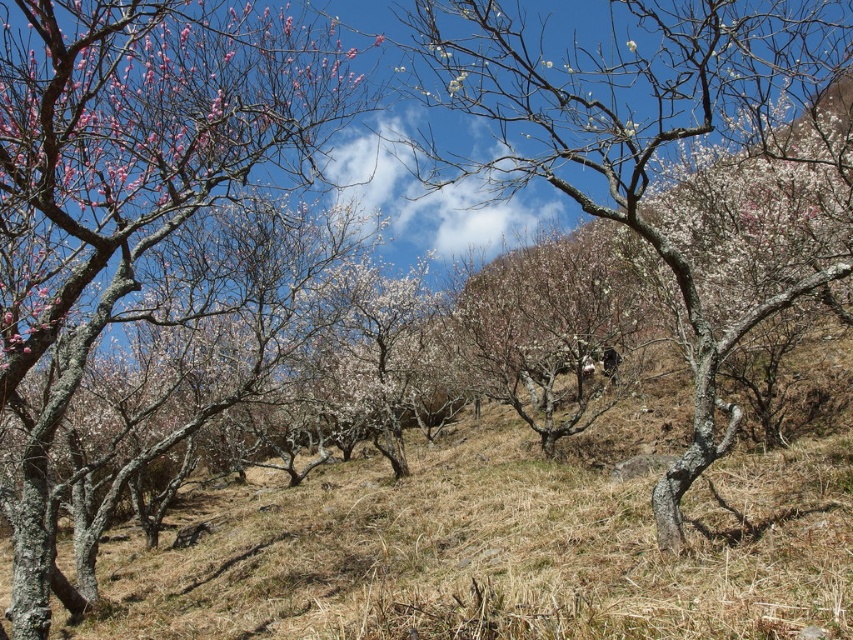
Question: Where is smooth bark tree at left located in relation to white textured tree at center in the image?

Choices:
 (A) below
 (B) above

Answer: (A)

Question: Does smooth bark tree at left have a lesser width compared to white textured tree at center?

Choices:
 (A) yes
 (B) no

Answer: (A)

Question: Which of the following is the closest to the observer?

Choices:
 (A) (77, 269)
 (B) (755, 134)

Answer: (A)

Question: From the image, what is the correct spatial relationship of smooth bark tree at left in relation to white textured tree at center?

Choices:
 (A) left
 (B) right

Answer: (A)